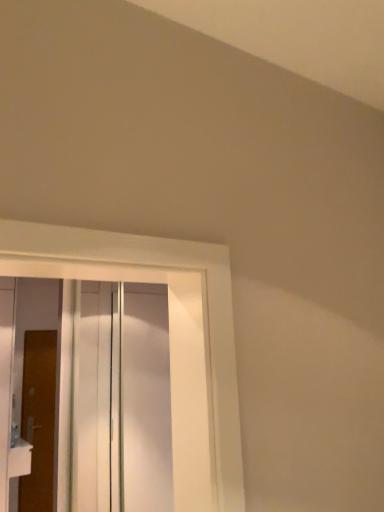
Question: Is white glossy door at left, the 1th door when ordered from front to back, turned away from brown wooden door at left, which appears as the first door when viewed from the back?

Choices:
 (A) yes
 (B) no

Answer: (B)

Question: From a real-world perspective, does white glossy door at left, the 1th door when ordered from front to back, stand above brown wooden door at left, which appears as the first door when viewed from the back?

Choices:
 (A) yes
 (B) no

Answer: (A)

Question: Would you say white glossy door at left, placed as the second door when sorted from back to front, contains brown wooden door at left, arranged as the second door when viewed from the front?

Choices:
 (A) no
 (B) yes

Answer: (A)

Question: Could you tell me if white glossy door at left, the 1th door when ordered from front to back, is facing brown wooden door at left, arranged as the second door when viewed from the front?

Choices:
 (A) yes
 (B) no

Answer: (B)

Question: Are white glossy door at left, the 1th door when ordered from front to back, and brown wooden door at left, which appears as the first door when viewed from the back, beside each other?

Choices:
 (A) yes
 (B) no

Answer: (B)

Question: Is white glossy door at left, the 1th door when ordered from front to back, at the left side of brown wooden door at left, which appears as the first door when viewed from the back?

Choices:
 (A) yes
 (B) no

Answer: (A)

Question: Is transparent glass door at center a part of brown wooden door at left, arranged as the second door when viewed from the front?

Choices:
 (A) no
 (B) yes

Answer: (A)

Question: Would you say brown wooden door at left, arranged as the second door when viewed from the front, is outside transparent glass door at center?

Choices:
 (A) yes
 (B) no

Answer: (A)

Question: Can you confirm if brown wooden door at left, arranged as the second door when viewed from the front, is thinner than transparent glass door at center?

Choices:
 (A) yes
 (B) no

Answer: (A)

Question: Does brown wooden door at left, which appears as the first door when viewed from the back, turn towards transparent glass door at center?

Choices:
 (A) yes
 (B) no

Answer: (A)

Question: Does brown wooden door at left, arranged as the second door when viewed from the front, have a greater height compared to transparent glass door at center?

Choices:
 (A) yes
 (B) no

Answer: (A)

Question: From a real-world perspective, is brown wooden door at left, arranged as the second door when viewed from the front, located beneath transparent glass door at center?

Choices:
 (A) no
 (B) yes

Answer: (B)

Question: Considering the relative sizes of white glossy door at left, placed as the second door when sorted from back to front, and transparent glass door at center in the image provided, is white glossy door at left, placed as the second door when sorted from back to front, thinner than transparent glass door at center?

Choices:
 (A) no
 (B) yes

Answer: (B)